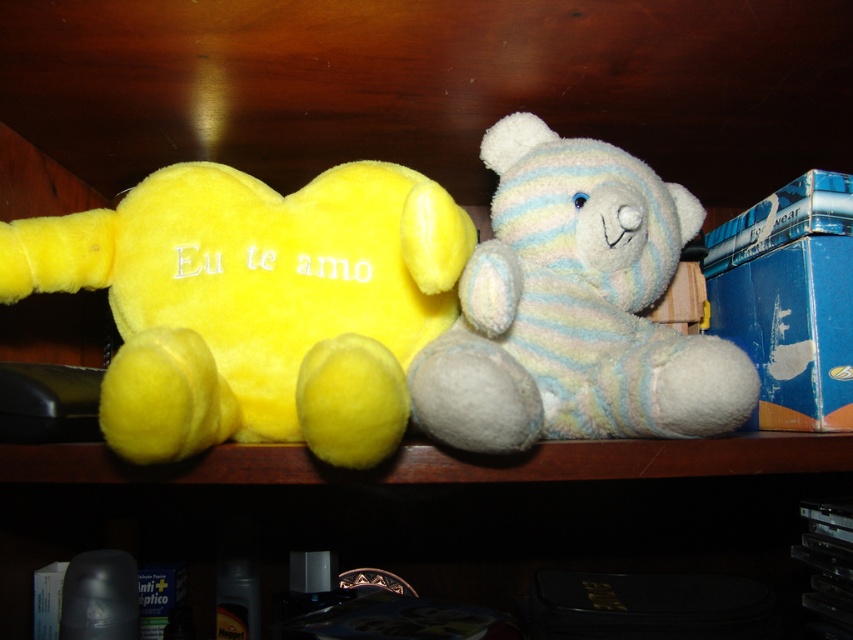
Between point (74, 259) and point (579, 212), which one is positioned in front?

Positioned in front is point (579, 212).

Does yellow plush heart at center have a greater width compared to white soft teddy bear at center?

Yes, yellow plush heart at center is wider than white soft teddy bear at center.

The width and height of the screenshot is (853, 640). What do you see at coordinates (256, 304) in the screenshot?
I see `yellow plush heart at center` at bounding box center [256, 304].

The height and width of the screenshot is (640, 853). Find the location of `yellow plush heart at center`. yellow plush heart at center is located at coordinates (256, 304).